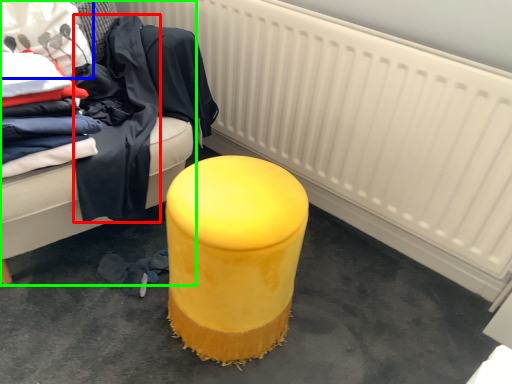
Question: Which is nearer to the clothing (highlighted by a red box)? clothing (highlighted by a blue box) or furniture (highlighted by a green box).

Choices:
 (A) clothing
 (B) furniture

Answer: (B)